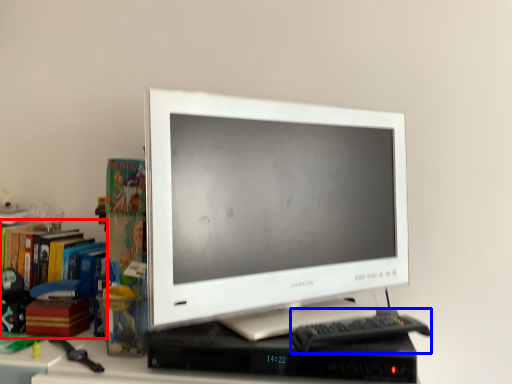
Question: Which point is further to the camera, bookcase (highlighted by a red box) or keyboard (highlighted by a blue box)?

Choices:
 (A) bookcase
 (B) keyboard

Answer: (A)